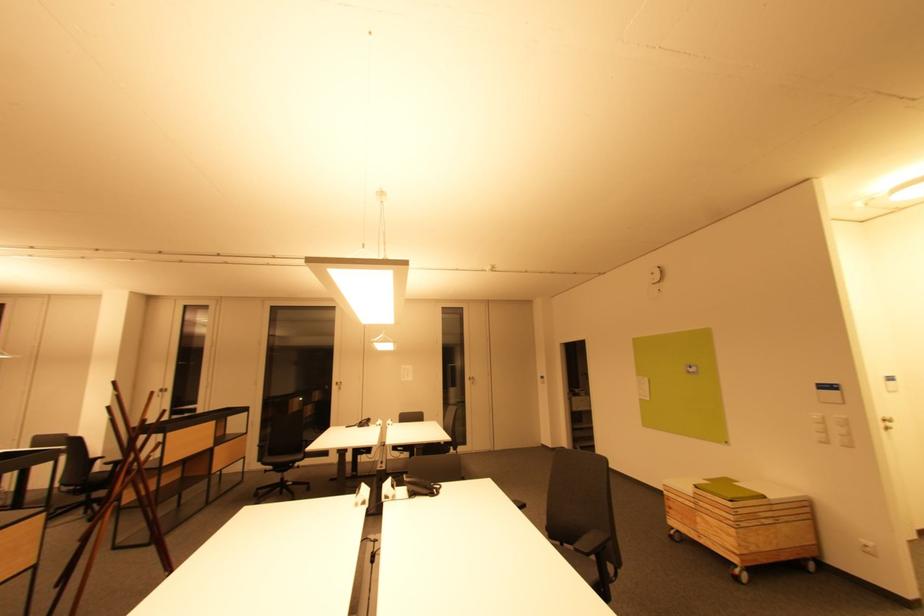
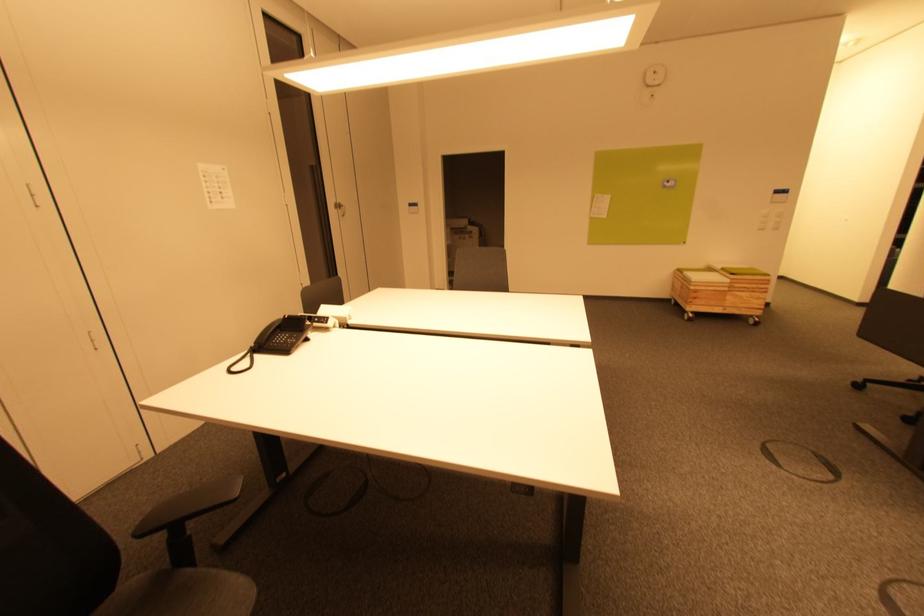
Find the pixel in the second image that matches (657,286) in the first image.

(652, 87)